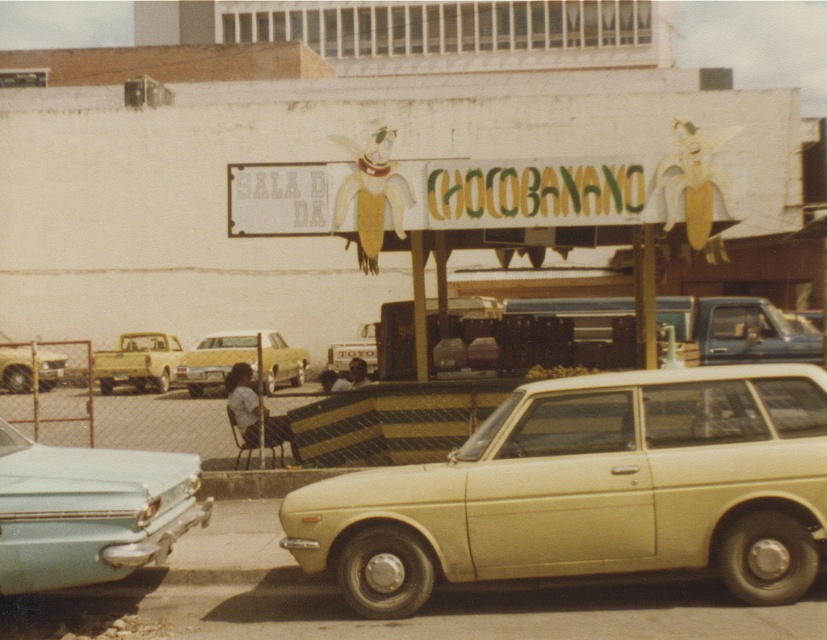
Question: Which point appears closest to the camera in this image?

Choices:
 (A) (22, 349)
 (B) (92, 536)
 (C) (154, 371)

Answer: (B)

Question: Considering the relative positions of beige matte station wagon at center and matte yellow truck at left in the image provided, where is beige matte station wagon at center located with respect to matte yellow truck at left?

Choices:
 (A) left
 (B) right

Answer: (B)

Question: Is matte yellow truck at left behind light yellow car at left?

Choices:
 (A) yes
 (B) no

Answer: (A)

Question: Estimate the real-world distances between objects in this image. Which object is farther from the light yellow car at left?

Choices:
 (A) yellow matte car at center
 (B) matte yellow truck at left
 (C) beige matte station wagon at center
 (D) light blue metallic car at lower left

Answer: (C)

Question: Among these objects, which one is farthest from the camera?

Choices:
 (A) light blue metallic car at lower left
 (B) matte yellow truck at left

Answer: (B)

Question: Can you confirm if matte yellow truck at left is smaller than light yellow car at left?

Choices:
 (A) no
 (B) yes

Answer: (B)